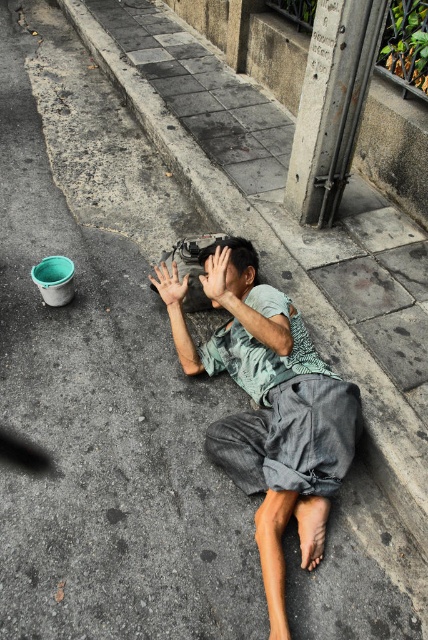
You are a passerby who notices the gray cotton shirt at center and the smooth skin hand at center. Which object is closer to you?

The gray cotton shirt at center is closer to the viewer than the smooth skin hand at center.